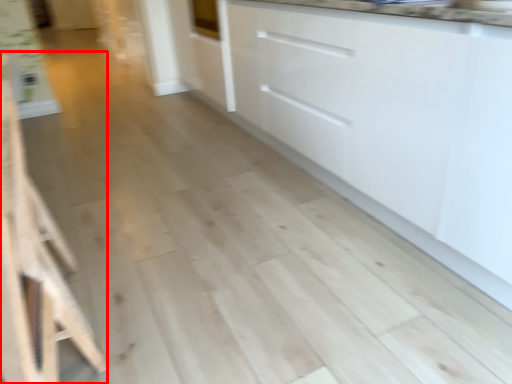
Question: Observing the image, what is the correct spatial positioning of furniture (annotated by the red box) in reference to cabinetry?

Choices:
 (A) right
 (B) left

Answer: (B)